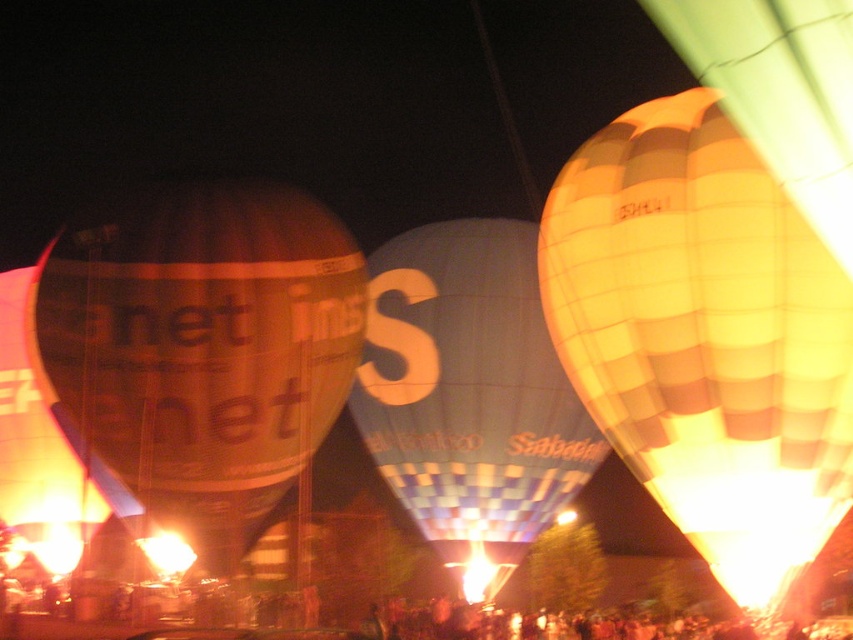
Question: Does yellow checkered balloon at right have a smaller size compared to translucent orange balloon at left?

Choices:
 (A) yes
 (B) no

Answer: (B)

Question: Is yellow checkered balloon at right further to the viewer compared to translucent orange balloon at left?

Choices:
 (A) yes
 (B) no

Answer: (B)

Question: Among these objects, which one is farthest from the camera?

Choices:
 (A) blue checkered fabric balloon at center
 (B) yellow checkered balloon at right

Answer: (A)

Question: Can you confirm if translucent orange balloon at left is wider than blue checkered fabric balloon at center?

Choices:
 (A) yes
 (B) no

Answer: (B)

Question: Among these points, which one is farthest from the camera?

Choices:
 (A) (607, 209)
 (B) (347, 368)
 (C) (509, 426)

Answer: (C)

Question: Which of the following is the closest to the observer?

Choices:
 (A) translucent orange balloon at left
 (B) yellow checkered balloon at right
 (C) blue checkered fabric balloon at center

Answer: (B)